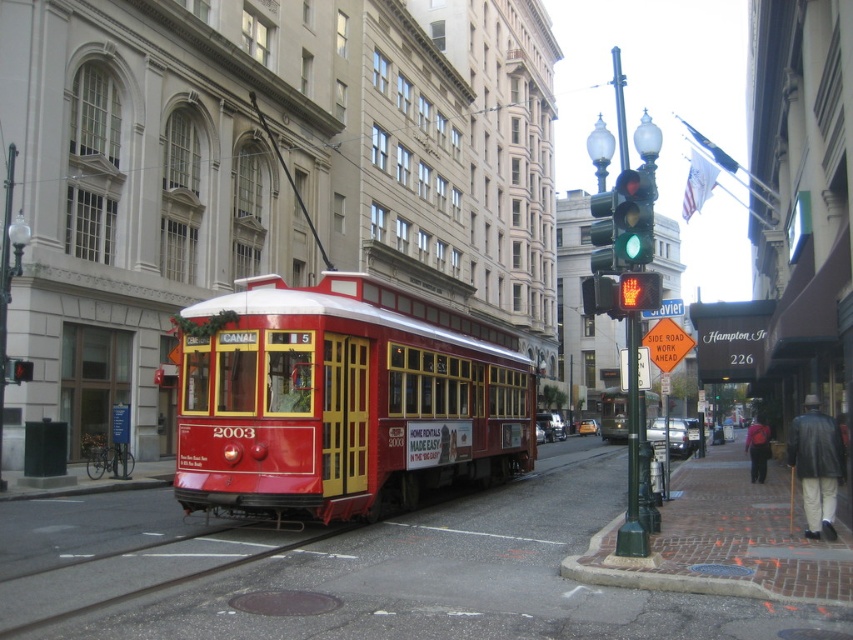
Question: Is green glass traffic light at upper center to the right of red glass pedestrian signal at center from the viewer's perspective?

Choices:
 (A) no
 (B) yes

Answer: (A)

Question: Can you confirm if green glass traffic light at upper center is positioned to the right of red glass pedestrian signal at center?

Choices:
 (A) no
 (B) yes

Answer: (A)

Question: Which of the following is the closest to the observer?

Choices:
 (A) green glass traffic light at upper center
 (B) red glass pedestrian signal at center

Answer: (B)

Question: Which point is closer to the camera?

Choices:
 (A) (640, 275)
 (B) (627, 218)

Answer: (A)

Question: Is green glass traffic light at upper center closer to the viewer compared to red glass pedestrian signal at center?

Choices:
 (A) no
 (B) yes

Answer: (A)

Question: Which object is closer to the camera taking this photo?

Choices:
 (A) red glass pedestrian signal at center
 (B) green glass traffic light at upper center

Answer: (A)